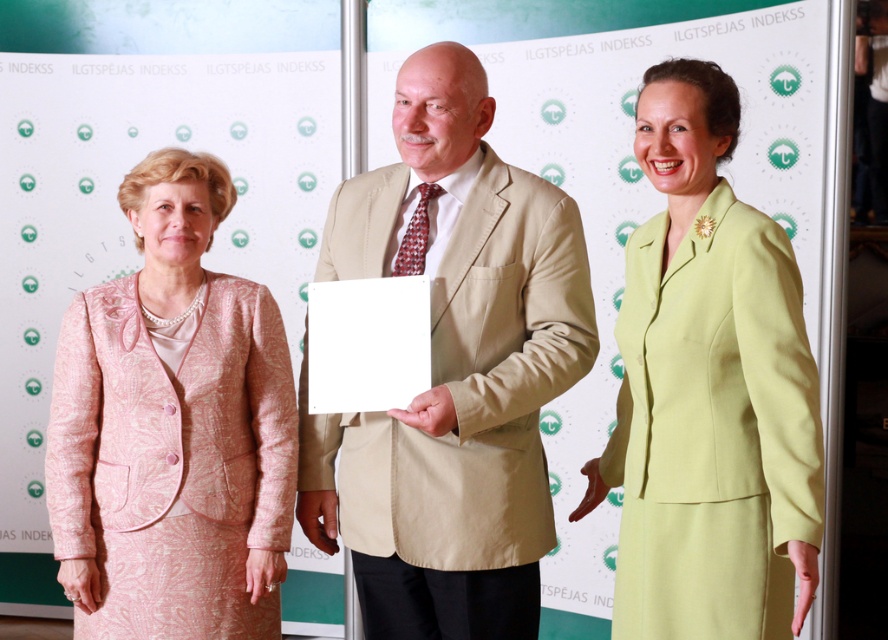
You are a photographer setting up for a group photo. You have two subjects wearing the beige fabric suit at center and the pink textured suit at left. Since you want to ensure both suits are visible in the frame, which subject should you position closer to the camera to maintain proportion?

The beige fabric suit at center is bigger than the pink textured suit at left, so positioning the beige fabric suit at center closer to the camera will help maintain proportion between their sizes.

You are a photographer setting up for a group photo. You notice the beige fabric suit at center and the pink textured suit at left. Which suit is covering part of the other?

The beige fabric suit at center is positioned over the pink textured suit at left, meaning it is covering part of the pink textured suit at left.